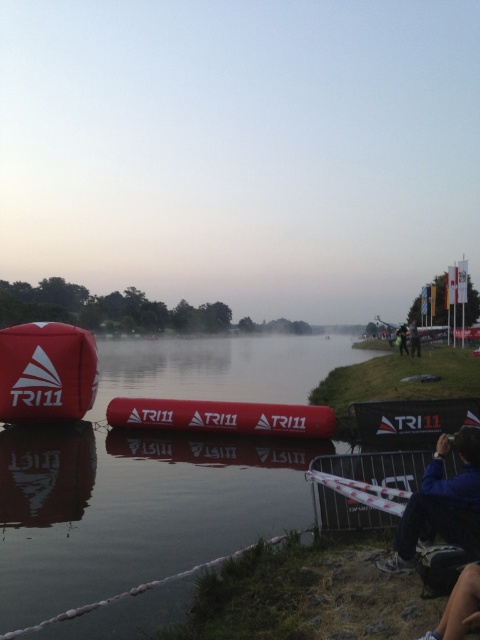
Question: Which object is farther from the camera taking this photo?

Choices:
 (A) matte red buoy at left
 (B) matte red buoy at center

Answer: (A)

Question: Which point is closer to the camera?

Choices:
 (A) (91, 349)
 (B) (472, 438)

Answer: (B)

Question: Which point is closer to the camera taking this photo?

Choices:
 (A) (x=440, y=465)
 (B) (x=242, y=426)

Answer: (A)

Question: Can you confirm if matte red buoy at left is smaller than blue fabric jacket at lower right?

Choices:
 (A) yes
 (B) no

Answer: (B)

Question: Considering the relative positions of matte red buoy at left and blue fabric jacket at lower right in the image provided, where is matte red buoy at left located with respect to blue fabric jacket at lower right?

Choices:
 (A) left
 (B) right

Answer: (A)

Question: Does blue fabric jacket at lower right have a smaller size compared to matte red buoy at center?

Choices:
 (A) yes
 (B) no

Answer: (A)